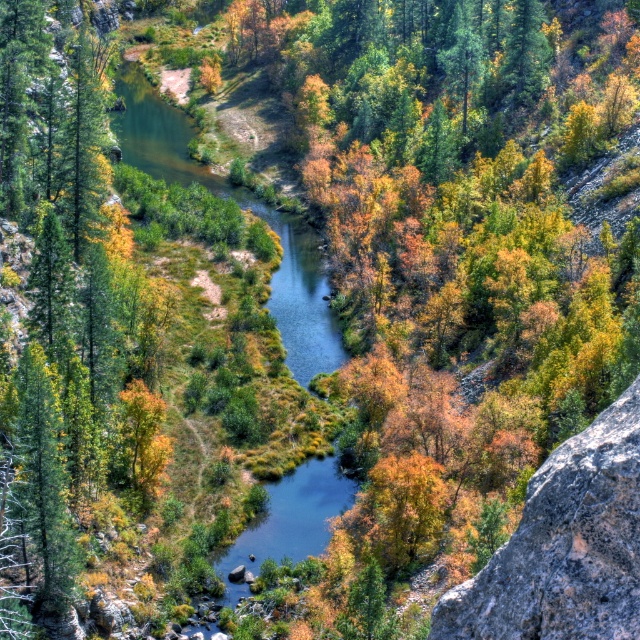
Who is more forward, [92,109] or [600,474]?

Point [600,474] is more forward.

Between point (68, 483) and point (502, 632), which one is positioned behind?

Positioned behind is point (68, 483).

Identify the location of green matte tree at left. Image resolution: width=640 pixels, height=640 pixels. (58, 310).